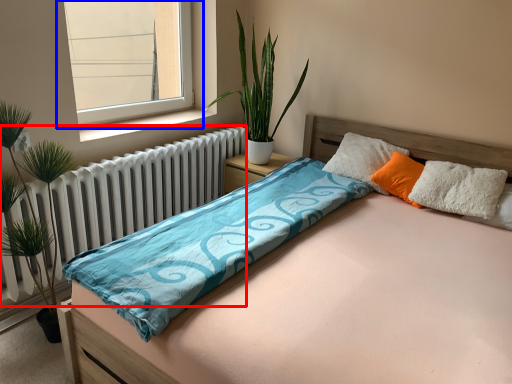
Question: Among these objects, which one is farthest to the camera, radiator (highlighted by a red box) or window (highlighted by a blue box)?

Choices:
 (A) radiator
 (B) window

Answer: (B)